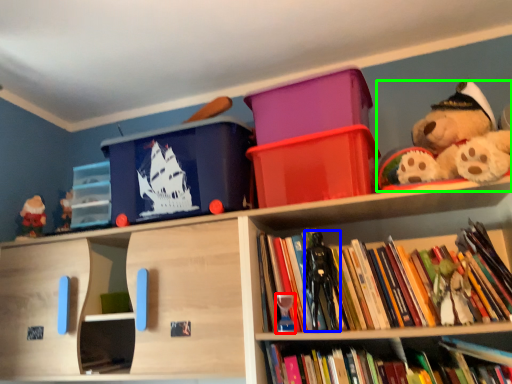
Question: Which object is the farthest from toy (highlighted by a red box)? Choose among these: toy (highlighted by a blue box) or teddy bear (highlighted by a green box).

Choices:
 (A) toy
 (B) teddy bear

Answer: (B)